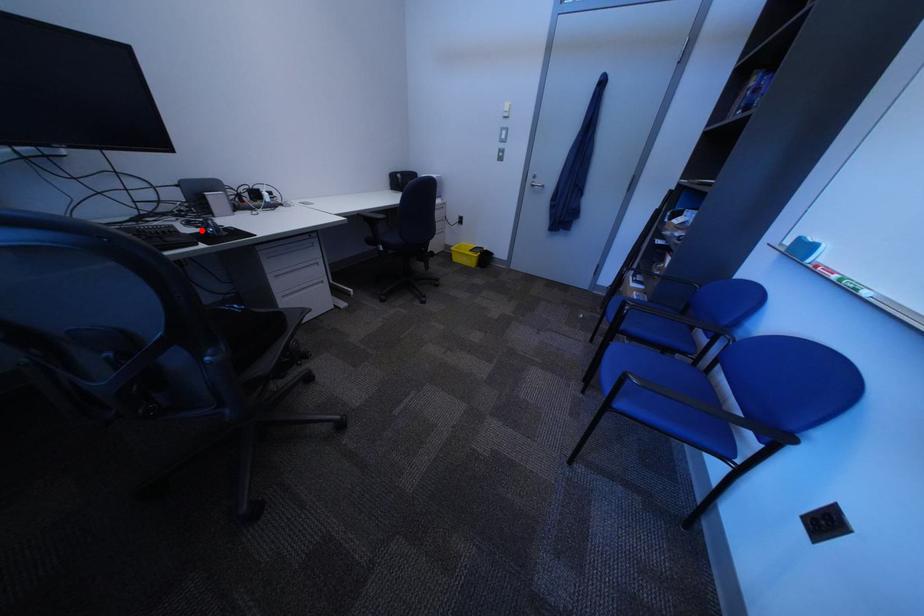
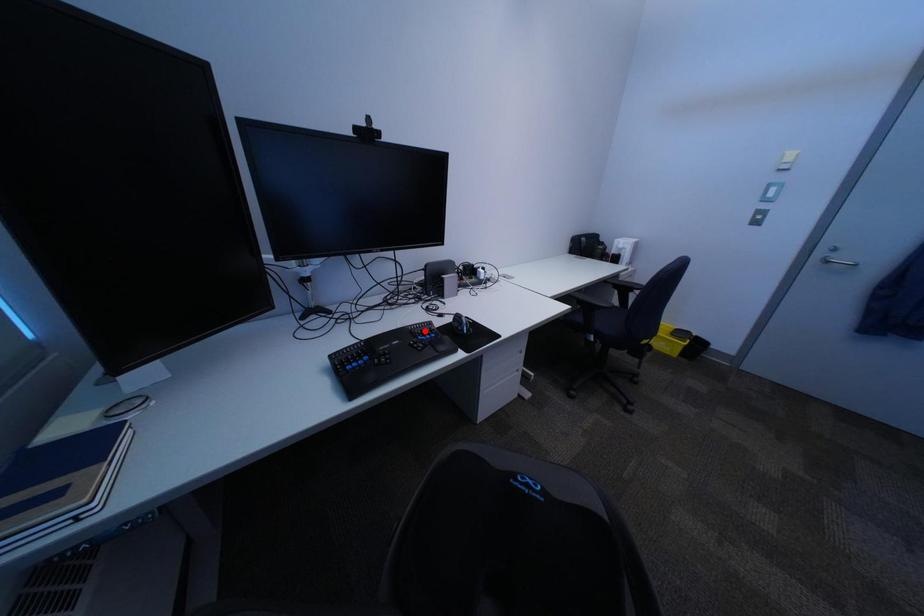
I am providing you with two images of the same scene from different viewpoints. A red point is marked on the first image and another point is marked on the second image. Are the points marked in image1 and image2 representing the same 3D position?

No